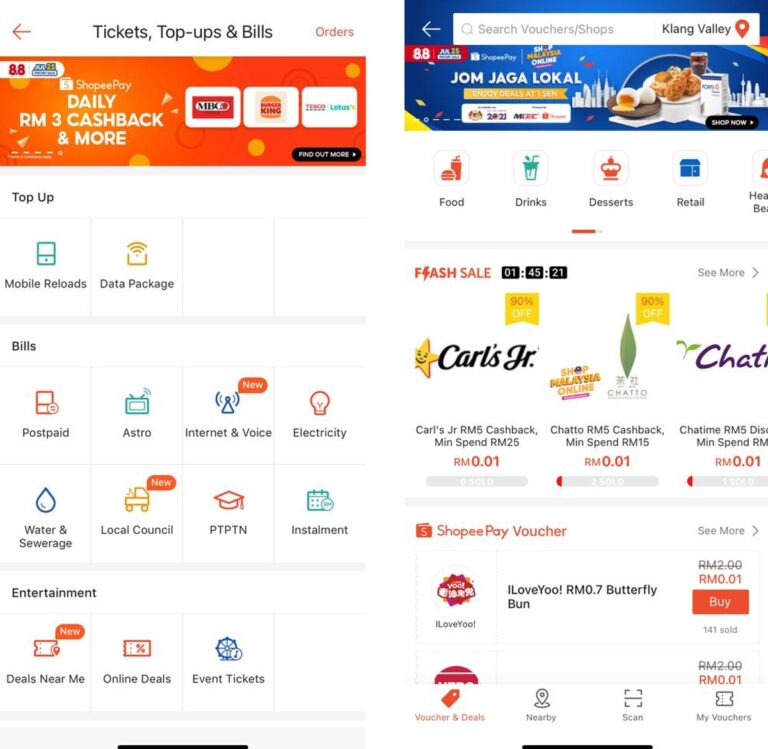
Where is `screen 2`? The height and width of the screenshot is (749, 768). screen 2 is located at coordinates (494, 12).